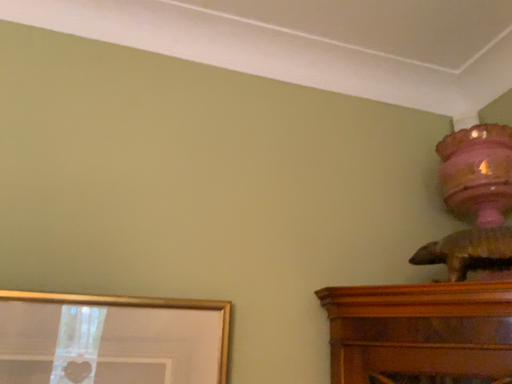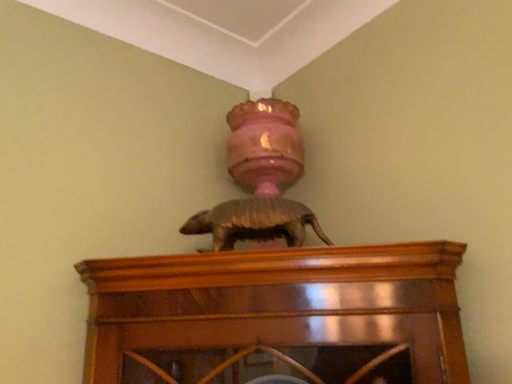
Question: Which way did the camera rotate in the video?

Choices:
 (A) rotated right
 (B) rotated left

Answer: (A)